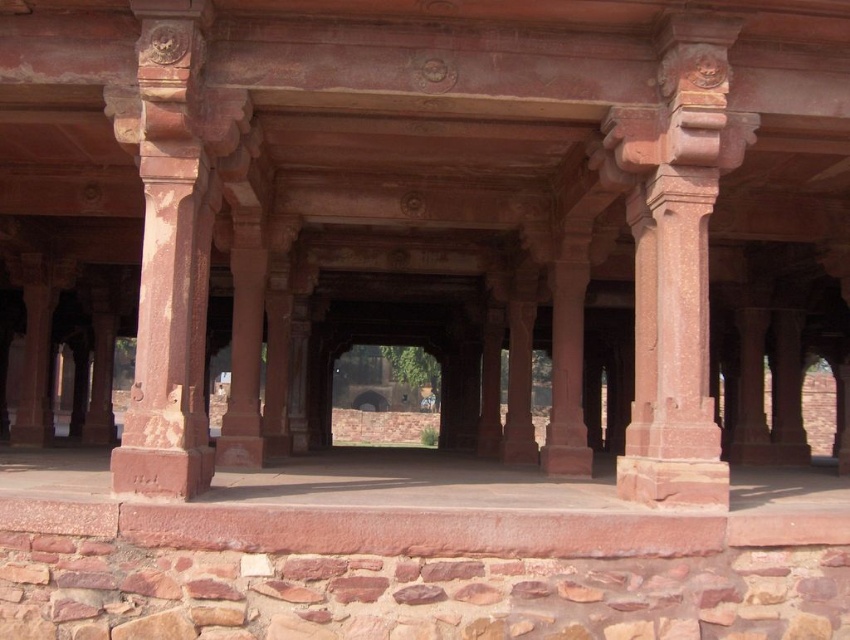
Looking at this image, who is positioned more to the left, rustic stone column at center or rustic stone column at left?

Positioned to the left is rustic stone column at left.

Which is behind, point (680, 131) or point (153, 410)?

Point (680, 131)

Does point (680, 93) come closer to viewer compared to point (153, 61)?

No, it is not.

Locate an element on the screen. The image size is (850, 640). rustic stone column at center is located at coordinates (676, 259).